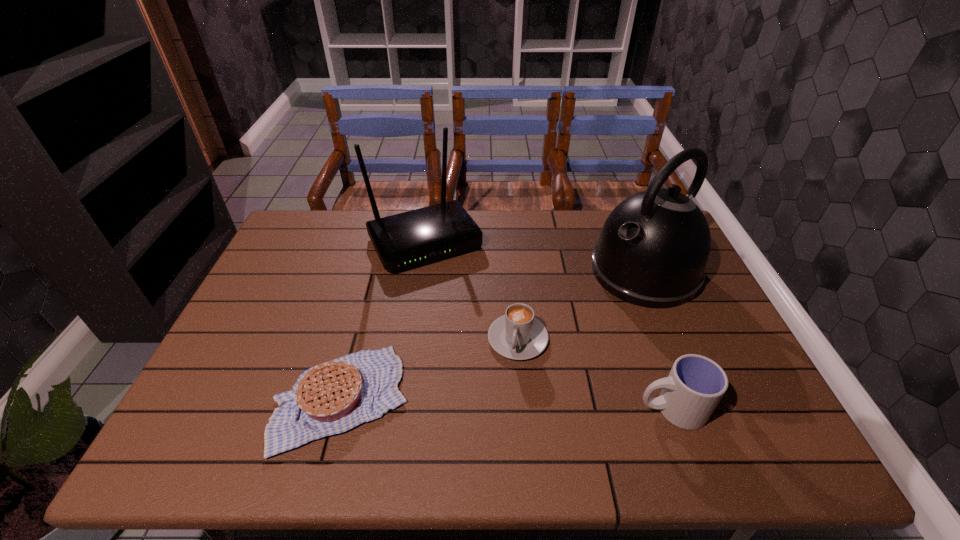
This screenshot has height=540, width=960. Find the location of `free space at the right edge of the desktop`. free space at the right edge of the desktop is located at coordinates pos(685,321).

The image size is (960, 540). Find the location of `vacant space at the near left corner of the desktop`. vacant space at the near left corner of the desktop is located at coordinates (213, 414).

Where is `vacant space that's between the router and the third tallest object`? This screenshot has width=960, height=540. vacant space that's between the router and the third tallest object is located at coordinates (548, 325).

The width and height of the screenshot is (960, 540). Identify the location of free space between the third shortest object and the shortest object. (506, 404).

Identify the location of free spot between the cup and the shortest object. Image resolution: width=960 pixels, height=540 pixels. (506, 404).

This screenshot has width=960, height=540. What are the coordinates of `free point between the fourth tallest object and the kettle` in the screenshot? It's located at (581, 305).

Find the location of a particular element. Image resolution: width=960 pixels, height=540 pixels. free spot between the kettle and the cup is located at coordinates click(658, 340).

This screenshot has height=540, width=960. Find the location of `vacant region between the third shortest object and the fourth shortest object`. vacant region between the third shortest object and the fourth shortest object is located at coordinates (548, 325).

Find the location of a particular element. free spot between the shortest object and the third object from right to left is located at coordinates (429, 369).

Locate an element on the screen. This screenshot has height=540, width=960. free spot between the pie and the fourth tallest object is located at coordinates (429, 369).